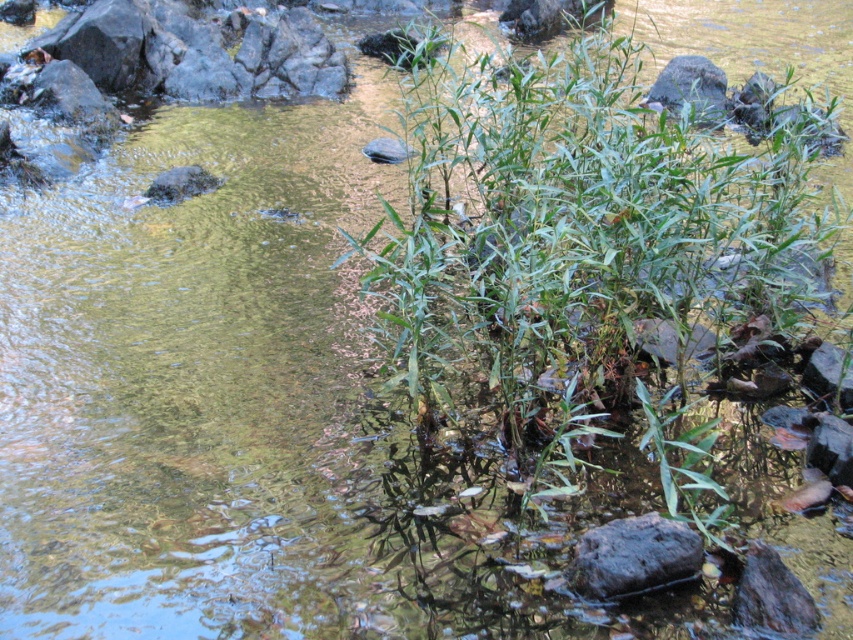
Question: Can you confirm if green leafy plant at center is thinner than dark gray rock at center?

Choices:
 (A) no
 (B) yes

Answer: (A)

Question: Which point appears farthest from the camera in this image?

Choices:
 (A) (643, 538)
 (B) (625, 228)

Answer: (B)

Question: Among these objects, which one is nearest to the camera?

Choices:
 (A) dark gray rock at center
 (B) green leafy plant at center

Answer: (B)

Question: Which object appears closest to the camera in this image?

Choices:
 (A) dark gray rock at center
 (B) green leafy plant at center

Answer: (B)

Question: Is green leafy plant at center behind dark gray rock at center?

Choices:
 (A) no
 (B) yes

Answer: (A)

Question: Is green leafy plant at center to the right of dark gray rock at center from the viewer's perspective?

Choices:
 (A) no
 (B) yes

Answer: (B)